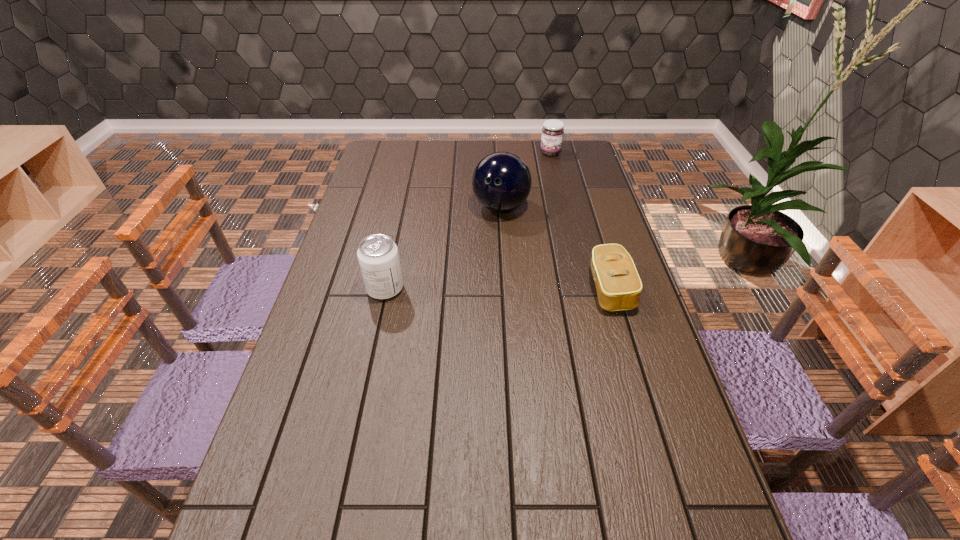
Locate an element on the screen. Image resolution: width=960 pixels, height=540 pixels. blank region between the soda can and the farthest object is located at coordinates (468, 221).

The image size is (960, 540). What are the coordinates of `free space that is in between the third shortest object and the jam` in the screenshot? It's located at (468, 221).

Identify which object is the third closest to the bowling ball. Please provide its 2D coordinates. Your answer should be formatted as a tuple, i.e. [(x, y)], where the tuple contains the x and y coordinates of a point satisfying the conditions above.

[(378, 257)]

You are a GUI agent. You are given a task and a screenshot of the screen. Output one action in this format:
    pyautogui.click(x=<x>, y=<y>)
    Task: Click on the closest object to the farthest object
    
    Given the screenshot: What is the action you would take?
    pyautogui.click(x=501, y=182)

Find the location of `vacant area in the image that satisfies the following two spatial constraints: 1. on the back side of the leftmost object; 2. on the left side of the bowling ball`. vacant area in the image that satisfies the following two spatial constraints: 1. on the back side of the leftmost object; 2. on the left side of the bowling ball is located at coordinates (403, 207).

Where is `vacant region that satisfies the following two spatial constraints: 1. on the back side of the shortest object; 2. on the zipper side of the leftmost object`? This screenshot has height=540, width=960. vacant region that satisfies the following two spatial constraints: 1. on the back side of the shortest object; 2. on the zipper side of the leftmost object is located at coordinates (385, 289).

Locate an element on the screen. This screenshot has width=960, height=540. blank area in the image that satisfies the following two spatial constraints: 1. on the front side of the second shortest object; 2. on the zipper side of the shortest object is located at coordinates (582, 289).

The width and height of the screenshot is (960, 540). I want to click on free location that satisfies the following two spatial constraints: 1. on the front side of the third object from right to left; 2. on the zipper side of the clutch bag, so click(505, 289).

Where is `vacant area that satisfies the following two spatial constraints: 1. on the back side of the soda can; 2. on the zipper side of the clutch bag`? vacant area that satisfies the following two spatial constraints: 1. on the back side of the soda can; 2. on the zipper side of the clutch bag is located at coordinates (385, 289).